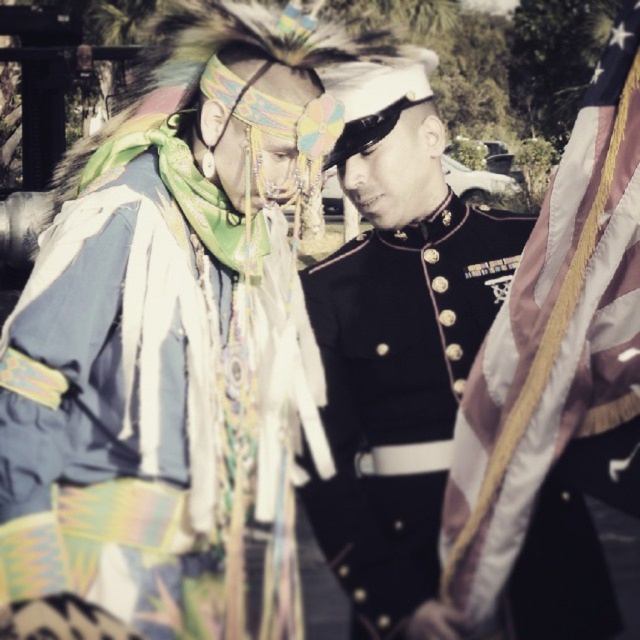
Question: Which point appears closest to the camera in this image?

Choices:
 (A) (516, 452)
 (B) (97, 442)
 (C) (468, 289)

Answer: (A)

Question: Does textured fabric headdress at upper left have a larger size compared to black polished uniform at center?

Choices:
 (A) no
 (B) yes

Answer: (B)

Question: Is textured fabric headdress at upper left behind silky satin flag at right?

Choices:
 (A) yes
 (B) no

Answer: (A)

Question: Does textured fabric headdress at upper left appear under black polished uniform at center?

Choices:
 (A) yes
 (B) no

Answer: (B)

Question: Which point is farther to the camera?

Choices:
 (A) silky satin flag at right
 (B) textured fabric headdress at upper left

Answer: (B)

Question: Estimate the real-world distances between objects in this image. Which object is closer to the silky satin flag at right?

Choices:
 (A) black polished uniform at center
 (B) textured fabric headdress at upper left

Answer: (A)